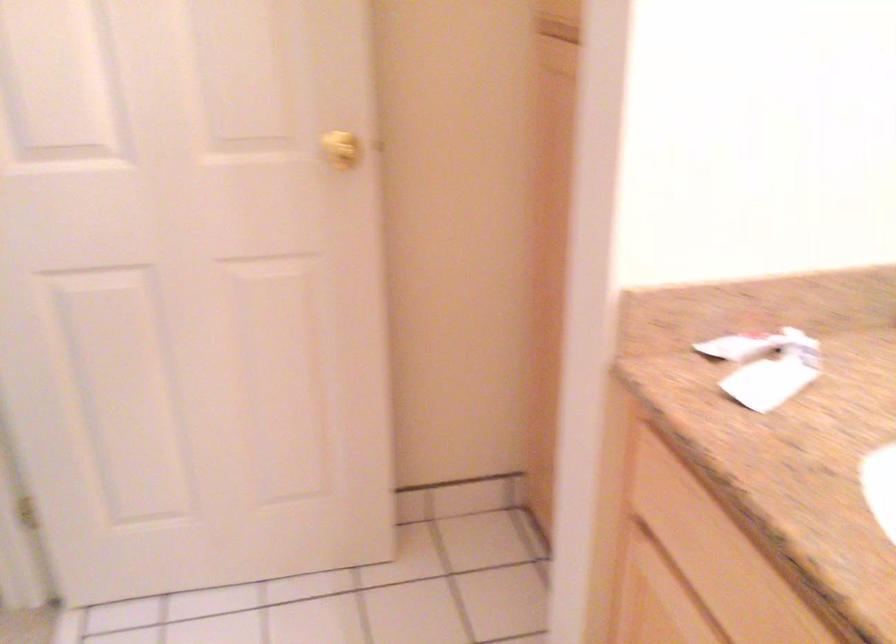
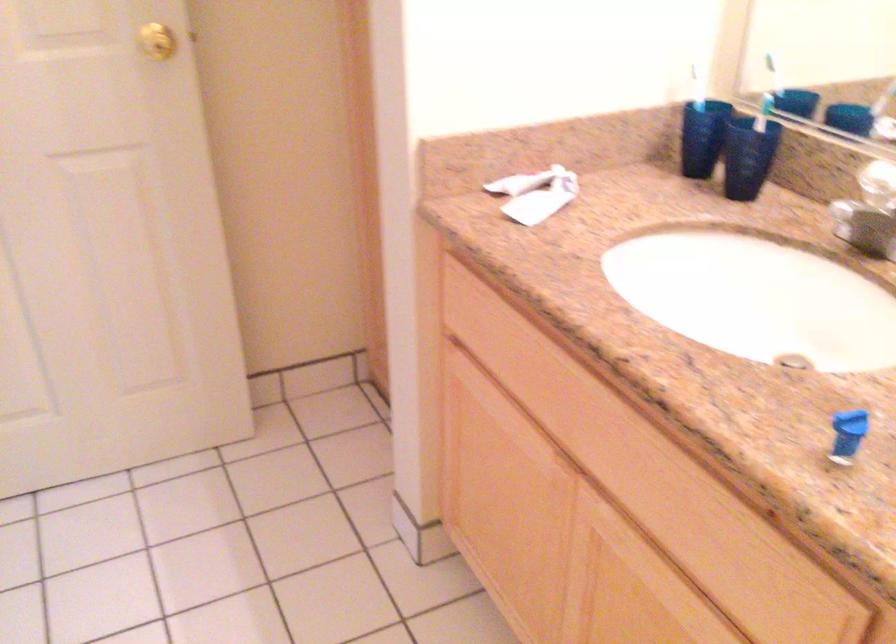
Question: In a continuous first-person perspective shot, in which direction is the camera moving?

Choices:
 (A) Left
 (B) Right
 (C) Forward
 (D) Backward

Answer: (D)